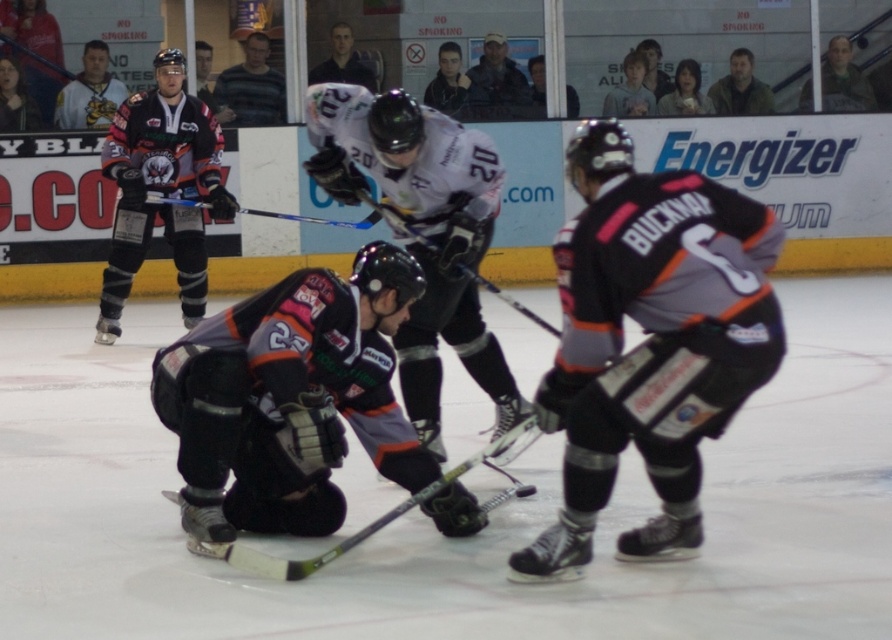
Can you confirm if black matte jersey at center is positioned to the left of matte black jersey at upper left?

In fact, black matte jersey at center is to the right of matte black jersey at upper left.

Is point (245, 417) closer to camera compared to point (178, 134)?

Yes, point (245, 417) is in front of point (178, 134).

Between point (246, 332) and point (199, 144), which one is positioned in front?

Point (246, 332) is more forward.

The image size is (892, 640). I want to click on black matte jersey at center, so click(290, 397).

Can you confirm if black matte jersey at center is positioned above white jersey at center?

Actually, black matte jersey at center is below white jersey at center.

Who is more forward, (358, 362) or (422, 205)?

Positioned in front is point (358, 362).

What do you see at coordinates (290, 397) in the screenshot?
I see `black matte jersey at center` at bounding box center [290, 397].

This screenshot has height=640, width=892. In order to click on black matte jersey at center in this screenshot , I will do `click(290, 397)`.

Consider the image. Can you confirm if matte black hockey stick at center is bigger than blue composite hockey stick at center?

Yes.

Between matte black hockey stick at center and blue composite hockey stick at center, which one appears on the left side from the viewer's perspective?

From the viewer's perspective, blue composite hockey stick at center appears more on the left side.

You are a GUI agent. You are given a task and a screenshot of the screen. Output one action in this format:
    pyautogui.click(x=<x>, y=<y>)
    Task: Click on the matte black hockey stick at center
    
    Given the screenshot: What is the action you would take?
    pyautogui.click(x=510, y=300)